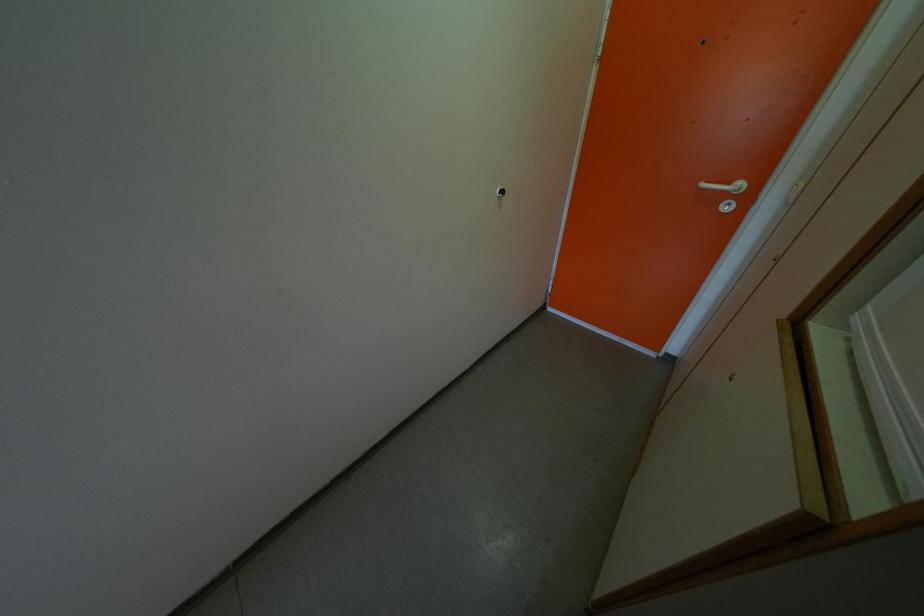
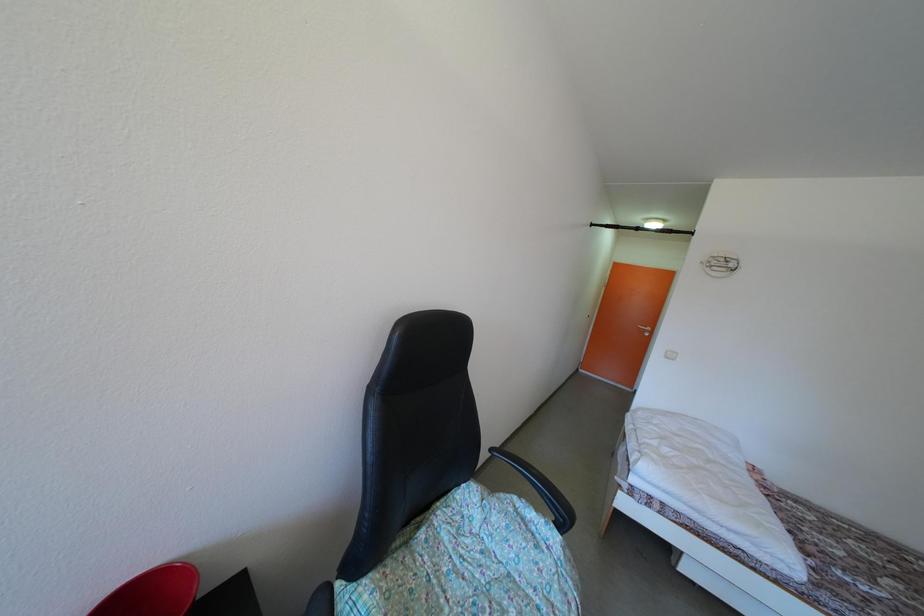
From the picture: What movement of the cameraman would produce the second image?

The cameraman moved toward left, backward.